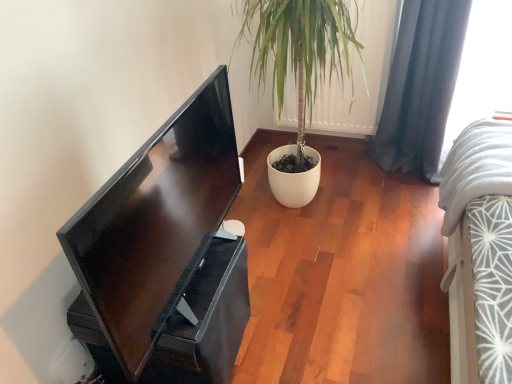
Where is `free space to the left of dark blue fabric curtain at right`? The image size is (512, 384). free space to the left of dark blue fabric curtain at right is located at coordinates (351, 174).